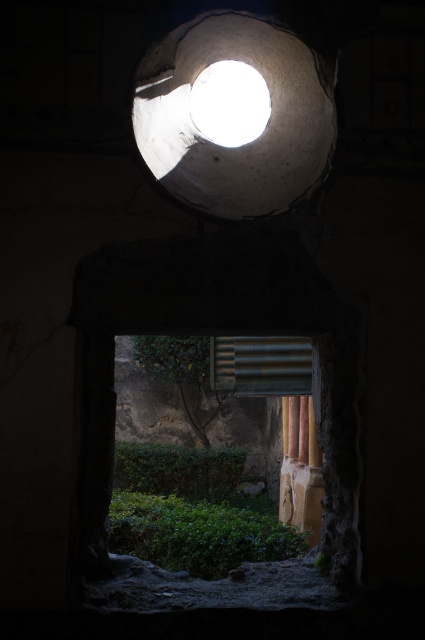
Question: Which object is positioned closest to the white matte light at upper center?

Choices:
 (A) white matte hole at upper center
 (B) smooth stone pillar at right

Answer: (A)

Question: Which is nearer to the white matte light at upper center?

Choices:
 (A) white matte hole at upper center
 (B) smooth stone pillar at right

Answer: (A)

Question: Does white matte light at upper center have a larger size compared to smooth stone pillar at right?

Choices:
 (A) no
 (B) yes

Answer: (A)

Question: Which of the following is the farthest from the observer?

Choices:
 (A) click(x=217, y=77)
 (B) click(x=238, y=54)
 (C) click(x=305, y=464)

Answer: (C)

Question: Does white matte hole at upper center lie behind smooth stone pillar at right?

Choices:
 (A) no
 (B) yes

Answer: (A)

Question: In this image, where is white matte hole at upper center located relative to smooth stone pillar at right?

Choices:
 (A) left
 (B) right

Answer: (A)